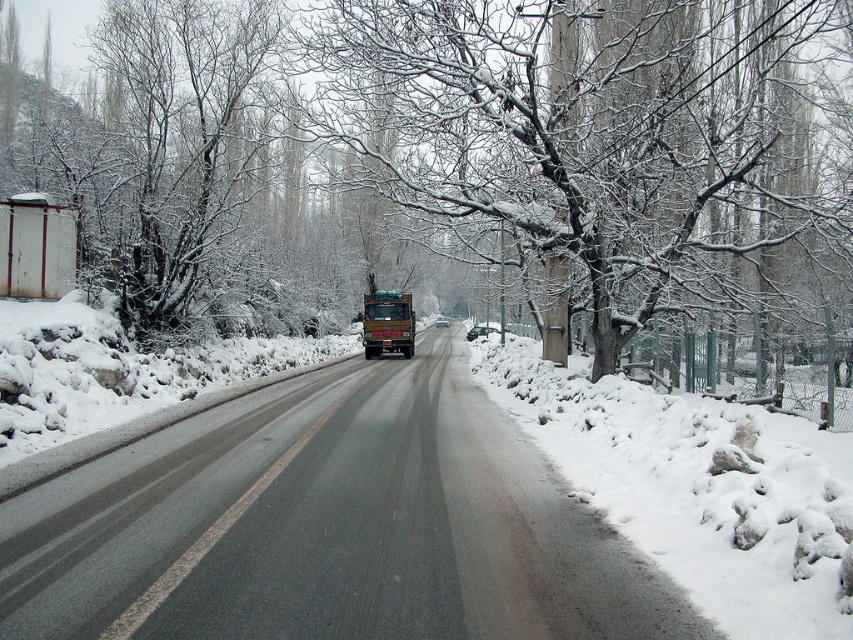
Question: Is snow-covered branches at center further to camera compared to matte brown truck at center?

Choices:
 (A) no
 (B) yes

Answer: (A)

Question: In this image, where is metallic truck at center located relative to matte brown truck at center?

Choices:
 (A) above
 (B) below

Answer: (B)

Question: Does metallic truck at center appear on the left side of white fluffy snow at right?

Choices:
 (A) no
 (B) yes

Answer: (B)

Question: Which point appears closest to the camera in this image?

Choices:
 (A) (674, 540)
 (B) (183, 483)
 (C) (405, 326)

Answer: (A)

Question: Which point is closer to the camera taking this photo?

Choices:
 (A) (x=682, y=557)
 (B) (x=407, y=340)
 (C) (x=515, y=486)
 (D) (x=466, y=211)

Answer: (A)

Question: Which of the following is the farthest from the observer?

Choices:
 (A) (850, 45)
 (B) (699, 557)
 (C) (393, 348)
 (D) (556, 620)

Answer: (C)